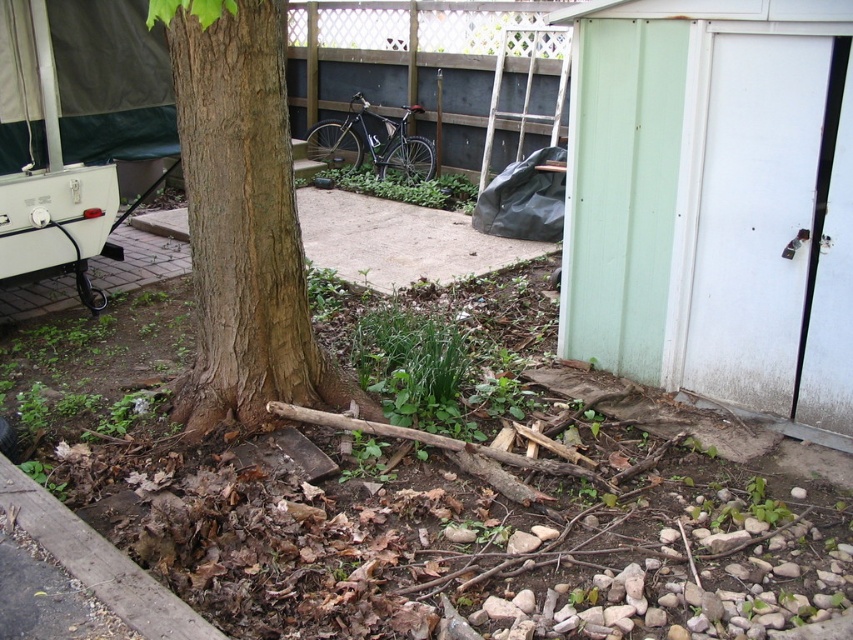
Is brown rough bark tree at center wider than matte black bicycle at center?

In fact, brown rough bark tree at center might be narrower than matte black bicycle at center.

Is point (207, 330) more distant than point (350, 128)?

No, (207, 330) is closer to viewer.

Locate an element on the screen. Image resolution: width=853 pixels, height=640 pixels. brown rough bark tree at center is located at coordinates (242, 220).